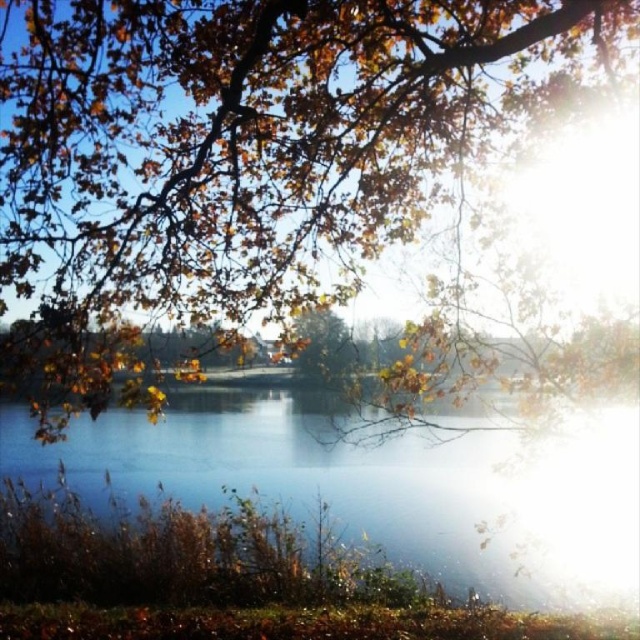
You are standing in the autumn scene by the water and want to take a photo of the golden leafy branches at upper center. Where should you aim your camera to capture them in the frame?

The golden leafy branches at upper center are located at the 2D coordinates point (234, 150), so aim your camera towards that point to capture them in the frame.

You are standing at the edge of the water in the autumn scene. There are two points marked in the image, point A at coordinates point (90, 156) and point B at coordinates point (467, 456). If you were to walk towards point B, would point A be closer to you or farther away than point B?

Point A is in front of point B, so when you walk towards point B, point A will be closer to you than point B.

You are an artist who wants to paint the scene. You have two canvases, one small and one large. Which object should you paint on the small canvas to match its actual size? Please choose between the golden leafy branches at upper center and the clear water at center.

The golden leafy branches at upper center has a smaller size compared to clear water at center, so you should paint the golden leafy branches at upper center on the small canvas to match its actual size.